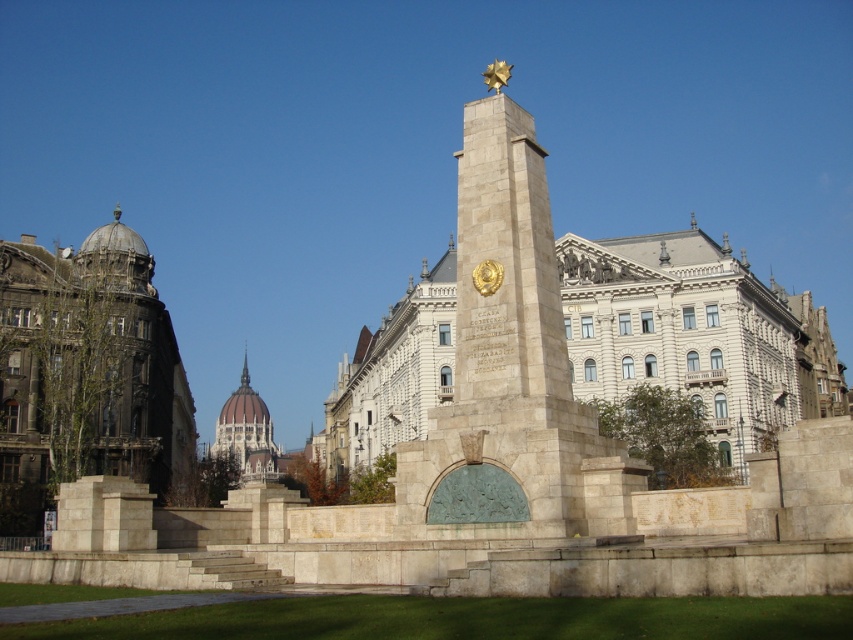
Can you confirm if beige stone monument at center is taller than greenish stone dome at center?

Yes, beige stone monument at center is taller than greenish stone dome at center.

Can you confirm if beige stone monument at center is positioned below greenish stone dome at center?

No.

Where is `beige stone monument at center`? The image size is (853, 640). beige stone monument at center is located at coordinates (697, 333).

Who is positioned more to the right, beige stone monument at center or stone obelisk at center?

Positioned to the right is beige stone monument at center.

Is point (817, 310) positioned behind point (548, 236)?

That is True.

This screenshot has width=853, height=640. Describe the element at coordinates (697, 333) in the screenshot. I see `beige stone monument at center` at that location.

This screenshot has width=853, height=640. What are the coordinates of `beige stone monument at center` in the screenshot? It's located at (697, 333).

What do you see at coordinates (697, 333) in the screenshot? I see `beige stone monument at center` at bounding box center [697, 333].

Is point (585, 244) farther from camera compared to point (141, 452)?

Yes, it is.

Locate an element on the screen. The height and width of the screenshot is (640, 853). beige stone monument at center is located at coordinates (697, 333).